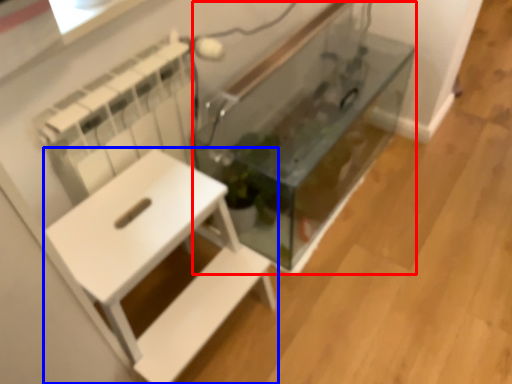
Question: Which point is further to the camera, glass box (highlighted by a red box) or furniture (highlighted by a blue box)?

Choices:
 (A) glass box
 (B) furniture

Answer: (A)